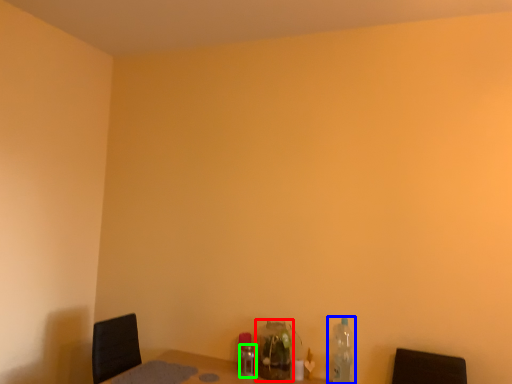
Question: Which object is positioned closest to bottle (highlighted by a red box)? Select from bottle (highlighted by a blue box) and bottle (highlighted by a green box).

Choices:
 (A) bottle
 (B) bottle

Answer: (B)